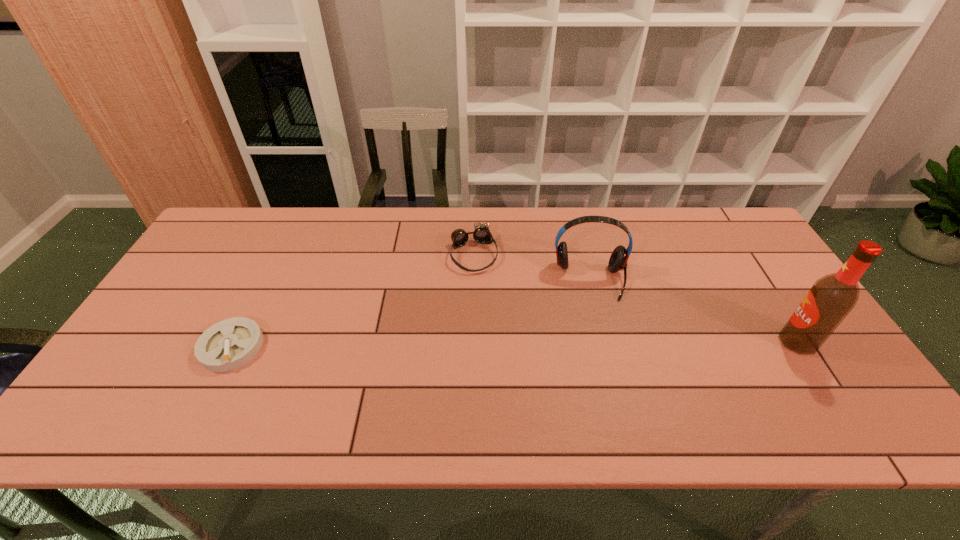
The image size is (960, 540). Identify the location of the shortest object. (229, 344).

I want to click on the leftmost object, so click(x=229, y=344).

At what (x,y) coordinates should I click in order to perform the action: click on the tallest object. Please return your answer as a coordinate pair (x, y). The image size is (960, 540). Looking at the image, I should click on (832, 297).

Locate an element on the screen. The width and height of the screenshot is (960, 540). the rightmost object is located at coordinates (832, 297).

Where is `the second object from left to right`? The height and width of the screenshot is (540, 960). the second object from left to right is located at coordinates (481, 234).

The image size is (960, 540). What are the coordinates of `goggles` in the screenshot? It's located at (481, 234).

Identify the location of the second object from right to left. (618, 260).

At what (x,y) coordinates should I click in order to perform the action: click on the third shortest object. Please return your answer as a coordinate pair (x, y). Looking at the image, I should click on (618, 260).

At what (x,y) coordinates should I click in order to perform the action: click on free space located on the left of the ashtray. Please return your answer as a coordinate pair (x, y). Looking at the image, I should click on (178, 347).

The image size is (960, 540). Find the location of `free space located 0.170m on the back of the tallest object`. free space located 0.170m on the back of the tallest object is located at coordinates (759, 283).